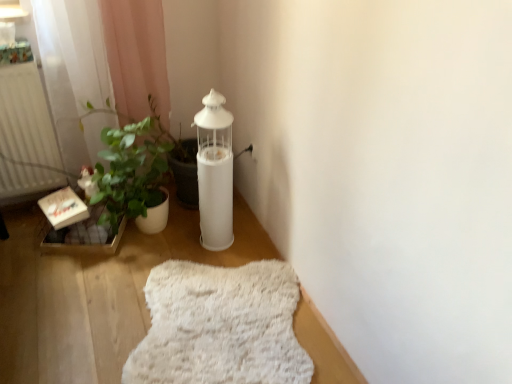
Identify the location of white fluffy rug at lower center. This screenshot has height=384, width=512. click(220, 326).

Measure the distance between point (123, 219) and camera.

The depth of point (123, 219) is 1.82 meters.

This screenshot has width=512, height=384. In order to click on white matte radiator at left in this screenshot , I will do `click(26, 117)`.

What is the approximate width of white matte oil lamp at center?

The width of white matte oil lamp at center is 7.09 inches.

Identify the location of white fluffy rug at lower center. (220, 326).

Where is `blanket in front of the white matte oil lamp at center`? blanket in front of the white matte oil lamp at center is located at coordinates (220, 326).

From a real-world perspective, does white fluffy rug at lower center sit lower than white matte oil lamp at center?

Yes.

Is white fluffy rug at lower center at the left side of white matte oil lamp at center?

No, white fluffy rug at lower center is not to the left of white matte oil lamp at center.

Does white matte oil lamp at center have a smaller size compared to wooden crate at lower left?

No.

Is point (228, 246) more distant than point (94, 240)?

Yes, it is behind point (94, 240).

Identify the location of oil lamp above the wooden crate at lower left (from a real-world perspective). (215, 172).

From a real-world perspective, is white matte oil lamp at center positioned under wooden crate at lower left based on gravity?

Incorrect, from a real-world perspective, white matte oil lamp at center is higher than wooden crate at lower left.

How different are the orientations of white matte radiator at left and white fluffy rug at lower center in degrees?

22.5 degrees.

In terms of width, does white matte radiator at left look wider or thinner when compared to white fluffy rug at lower center?

white matte radiator at left is thinner than white fluffy rug at lower center.

In terms of size, does white matte radiator at left appear bigger or smaller than white fluffy rug at lower center?

Considering their sizes, white matte radiator at left takes up more space than white fluffy rug at lower center.

Does white matte radiator at left touch white fluffy rug at lower center?

No, white matte radiator at left is not making contact with white fluffy rug at lower center.

Locate an element on the screen. The width and height of the screenshot is (512, 384). blanket below the wooden crate at lower left (from the image's perspective) is located at coordinates (220, 326).

Is wooden crate at lower left directly adjacent to white fluffy rug at lower center?

No, wooden crate at lower left is not with white fluffy rug at lower center.

Consider the image. Which object is further away from the camera taking this photo, wooden crate at lower left or white fluffy rug at lower center?

Positioned behind is wooden crate at lower left.

Image resolution: width=512 pixels, height=384 pixels. I want to click on window sill that is on the right side of white matte radiator at left, so click(x=83, y=236).

From a real-world perspective, is wooden crate at lower left on white matte radiator at left?

No, from a real-world perspective, wooden crate at lower left is not on top of white matte radiator at left.

Would you say wooden crate at lower left is outside white matte radiator at left?

Indeed, wooden crate at lower left is completely outside white matte radiator at left.

Who is taller, white matte radiator at left or white matte oil lamp at center?

white matte oil lamp at center.

Is the position of white matte radiator at left less distant than that of white matte oil lamp at center?

That is False.

Consider the image. Looking at their sizes, would you say white matte radiator at left is wider or thinner than white matte oil lamp at center?

white matte radiator at left is thinner than white matte oil lamp at center.

Between point (11, 179) and point (201, 225), which one is positioned behind?

The point (201, 225) is more distant.

Does point (212, 119) lie behind point (24, 96)?

No, it is not.

Is white matte oil lamp at center facing towards white matte radiator at left?

No, white matte oil lamp at center is not aimed at white matte radiator at left.

Is white matte oil lamp at center wider or thinner than white matte radiator at left?

white matte oil lamp at center is wider than white matte radiator at left.

The image size is (512, 384). Identify the location of blanket located in front of the white matte oil lamp at center. (220, 326).

Locate an element on the screen. oil lamp lying on the right of wooden crate at lower left is located at coordinates (215, 172).

When comparing their distances from white matte radiator at left, does white fluffy rug at lower center or white matte oil lamp at center seem further?

white fluffy rug at lower center is further to white matte radiator at left.

Estimate the real-world distances between objects in this image. Which object is further from white matte oil lamp at center, white matte radiator at left or wooden crate at lower left?

white matte radiator at left lies further to white matte oil lamp at center than the other object.

When comparing their distances from wooden crate at lower left, does white matte oil lamp at center or white matte radiator at left seem closer?

white matte radiator at left is closer to wooden crate at lower left.

Looking at this image, based on their spatial positions, is white matte oil lamp at center or white fluffy rug at lower center further from wooden crate at lower left?

white fluffy rug at lower center.

Which object lies nearer to the anchor point white matte radiator at left, wooden crate at lower left or white matte oil lamp at center?

wooden crate at lower left is positioned closer to the anchor white matte radiator at left.

Looking at the image, which one is located further to white fluffy rug at lower center, wooden crate at lower left or white matte oil lamp at center?

wooden crate at lower left lies further to white fluffy rug at lower center than the other object.

In the scene shown: Looking at the image, which one is located further to white matte oil lamp at center, white matte radiator at left or white fluffy rug at lower center?

white matte radiator at left is positioned further to the anchor white matte oil lamp at center.

Which object lies further to the anchor point white matte radiator at left, white fluffy rug at lower center or wooden crate at lower left?

white fluffy rug at lower center is positioned further to the anchor white matte radiator at left.

Image resolution: width=512 pixels, height=384 pixels. Identify the location of window sill located between white matte radiator at left and white matte oil lamp at center in the left-right direction. (83, 236).

Locate an element on the screen. Image resolution: width=512 pixels, height=384 pixels. oil lamp situated between wooden crate at lower left and white fluffy rug at lower center from left to right is located at coordinates (215, 172).

Find the location of a particular element. The width and height of the screenshot is (512, 384). oil lamp between white matte radiator at left and white fluffy rug at lower center from left to right is located at coordinates (215, 172).

You are a GUI agent. You are given a task and a screenshot of the screen. Output one action in this format:
    pyautogui.click(x=<x>, y=<y>)
    Task: Click on the window sill located between white matte radiator at left and white fluffy rug at lower center in the left-right direction
    The width and height of the screenshot is (512, 384).
    Given the screenshot: What is the action you would take?
    pyautogui.click(x=83, y=236)